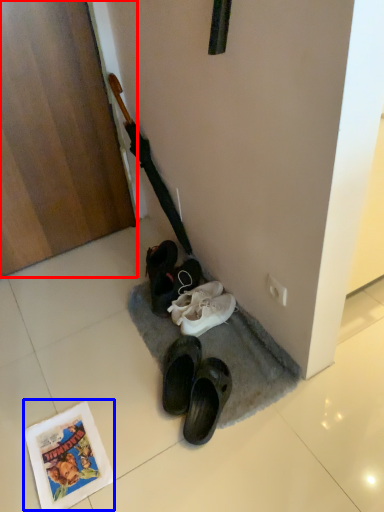
Question: Which of the following is the closest to the observer, door (highlighted by a red box) or comic book (highlighted by a blue box)?

Choices:
 (A) door
 (B) comic book

Answer: (B)